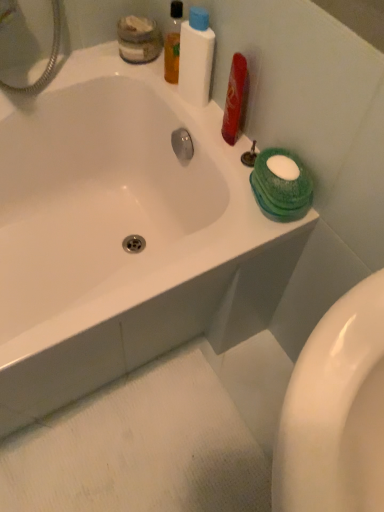
This screenshot has width=384, height=512. Find the location of `vacant space that is to the left of matte glass jar at upper left`. vacant space that is to the left of matte glass jar at upper left is located at coordinates (82, 68).